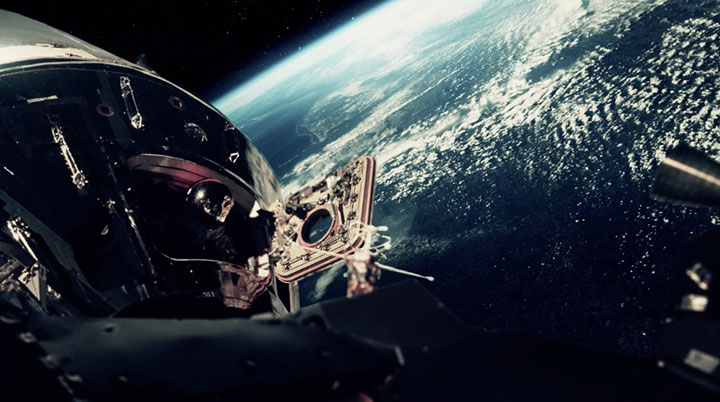
Image resolution: width=720 pixels, height=402 pixels. I want to click on door cable, so [199, 261].